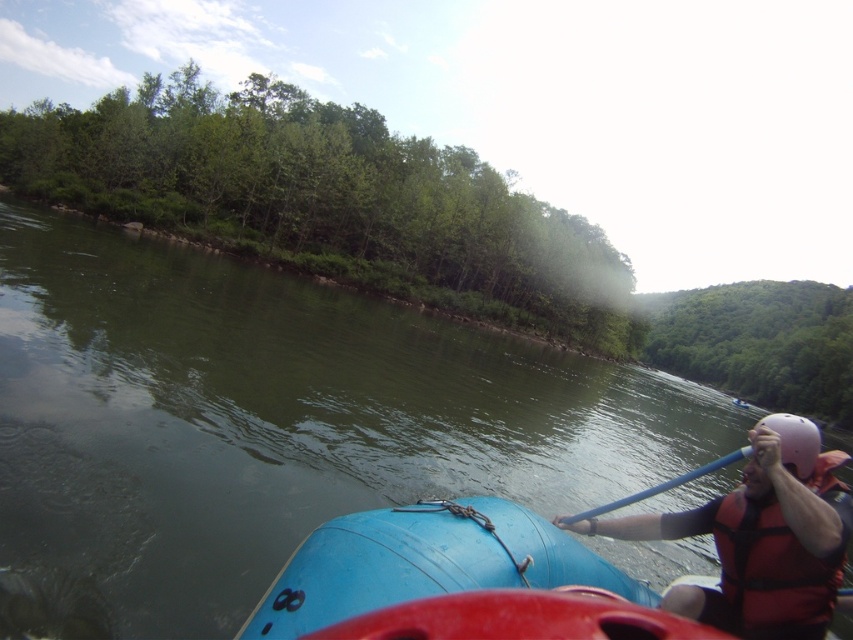
You are a safety inspector checking the gear placement on a raft. The red life vest at right and the peach matte helmet at right must be within 5 feet of each other for quick access. Based on the scene, are they positioned appropriately?

The distance between the red life vest at right and the peach matte helmet at right is 4.07 feet, which is within the 5 feet requirement, so they are positioned appropriately.

You are a safety inspector checking the gear of a river rafting participant. You observe the red life vest at right and the peach matte helmet at right. Which piece of equipment is positioned higher on the participant?

The red life vest at right is taller than the peach matte helmet at right, so the red life vest at right is positioned higher.

You are a photographer trying to capture a clear shot of the red life vest at right and the peach matte helmet at right. Since you want both items in focus, which one should you adjust your camera focus on first?

The red life vest at right is closer to the viewer than the peach matte helmet at right, so you should focus on the red life vest at right first to ensure both are in focus.